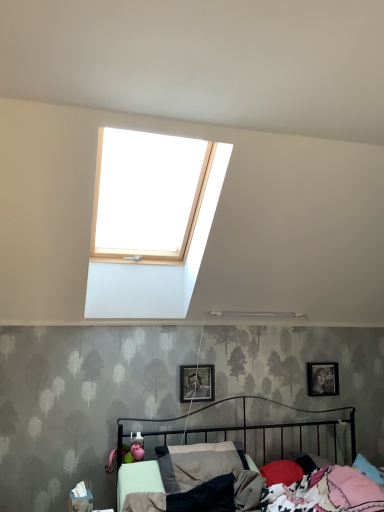
Question: Considering the relative positions of metallic silver photo frame at center, the 1th picture frame from the front, and metallic black bed at lower center in the image provided, is metallic silver photo frame at center, the 1th picture frame from the front, behind metallic black bed at lower center?

Choices:
 (A) yes
 (B) no

Answer: (A)

Question: Does metallic silver photo frame at center, the 1th picture frame from the front, have a greater height compared to metallic black bed at lower center?

Choices:
 (A) no
 (B) yes

Answer: (A)

Question: Is metallic silver photo frame at center, the 2th picture frame when ordered from right to left, shorter than metallic black bed at lower center?

Choices:
 (A) no
 (B) yes

Answer: (B)

Question: Is metallic silver photo frame at center, the 2th picture frame when ordered from right to left, smaller than metallic black bed at lower center?

Choices:
 (A) no
 (B) yes

Answer: (B)

Question: Does metallic silver photo frame at center, which is counted as the second picture frame, starting from the back, have a greater width compared to metallic black bed at lower center?

Choices:
 (A) no
 (B) yes

Answer: (A)

Question: Is metallic black bed at lower center taller or shorter than metallic silver photo frame at right, the second picture frame when ordered from front to back?

Choices:
 (A) short
 (B) tall

Answer: (B)

Question: Considering the positions of point (332, 486) and point (322, 388), is point (332, 486) closer or farther from the camera than point (322, 388)?

Choices:
 (A) farther
 (B) closer

Answer: (B)

Question: Considering the relative positions of metallic black bed at lower center and metallic silver photo frame at right, the second picture frame when ordered from front to back, in the image provided, is metallic black bed at lower center to the left or to the right of metallic silver photo frame at right, the second picture frame when ordered from front to back,?

Choices:
 (A) right
 (B) left

Answer: (B)

Question: Looking at their shapes, would you say metallic black bed at lower center is wider or thinner than metallic silver photo frame at right, placed as the first picture frame when sorted from right to left?

Choices:
 (A) thin
 (B) wide

Answer: (B)

Question: From their relative heights in the image, would you say metallic silver photo frame at center, the 1th picture frame when ordered from left to right, is taller or shorter than metallic silver photo frame at right, placed as the first picture frame when sorted from right to left?

Choices:
 (A) short
 (B) tall

Answer: (A)

Question: Considering the positions of point (208, 368) and point (314, 376), is point (208, 368) closer or farther from the camera than point (314, 376)?

Choices:
 (A) closer
 (B) farther

Answer: (A)

Question: From the image's perspective, is metallic silver photo frame at center, the 2th picture frame when ordered from right to left, positioned above or below metallic silver photo frame at right, the second picture frame positioned from the left?

Choices:
 (A) above
 (B) below

Answer: (A)

Question: From a real-world perspective, is metallic silver photo frame at center, the 1th picture frame when ordered from left to right, above or below metallic silver photo frame at right, which appears as the 1th picture frame when viewed from the back?

Choices:
 (A) above
 (B) below

Answer: (B)

Question: In terms of size, does metallic silver photo frame at right, placed as the first picture frame when sorted from right to left, appear bigger or smaller than metallic silver photo frame at center, the 1th picture frame when ordered from left to right?

Choices:
 (A) small
 (B) big

Answer: (A)

Question: From a real-world perspective, is metallic silver photo frame at right, the second picture frame when ordered from front to back, positioned above or below metallic silver photo frame at center, which is counted as the second picture frame, starting from the back?

Choices:
 (A) above
 (B) below

Answer: (A)